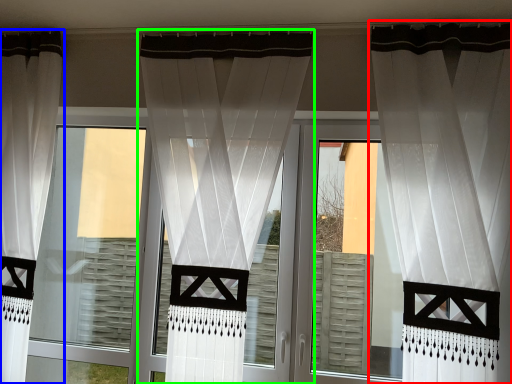
Question: Considering the real-world distances, which object is farthest from curtain (highlighted by a red box)? curtain (highlighted by a blue box) or curtain (highlighted by a green box)?

Choices:
 (A) curtain
 (B) curtain

Answer: (A)